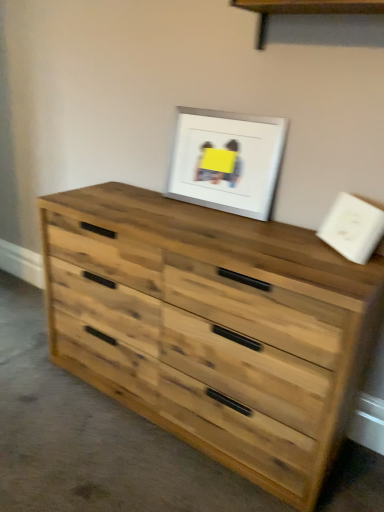
Question: Is wooden shelf at upper center inside or outside of natural wood chest of drawers at center?

Choices:
 (A) inside
 (B) outside

Answer: (B)

Question: From their relative heights in the image, would you say wooden shelf at upper center is taller or shorter than natural wood chest of drawers at center?

Choices:
 (A) tall
 (B) short

Answer: (B)

Question: Considering the real-world distances, which object is closest to the white matte picture frame at upper center?

Choices:
 (A) wooden shelf at upper center
 (B) natural wood chest of drawers at center

Answer: (A)

Question: Considering the real-world distances, which object is farthest from the wooden shelf at upper center?

Choices:
 (A) natural wood chest of drawers at center
 (B) white matte picture frame at upper center

Answer: (A)